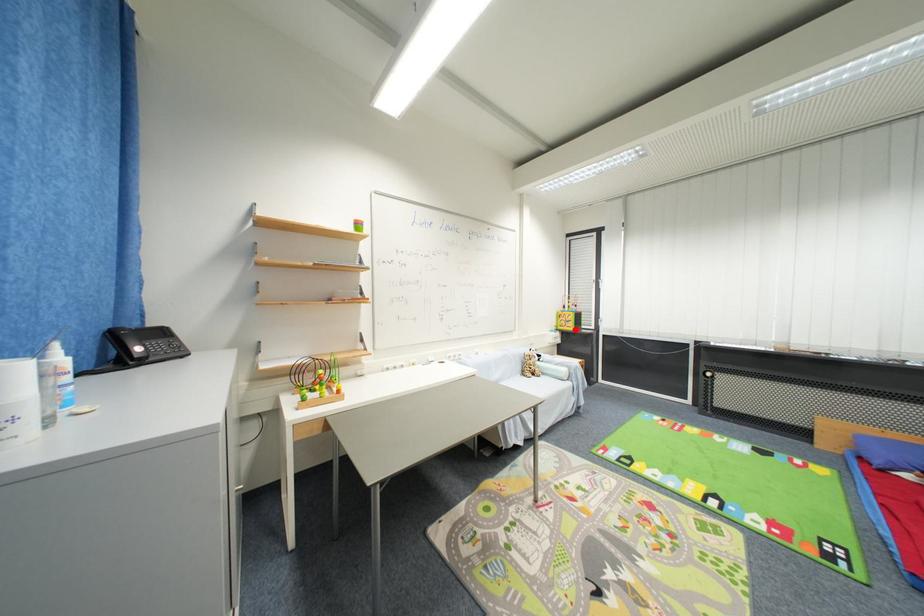
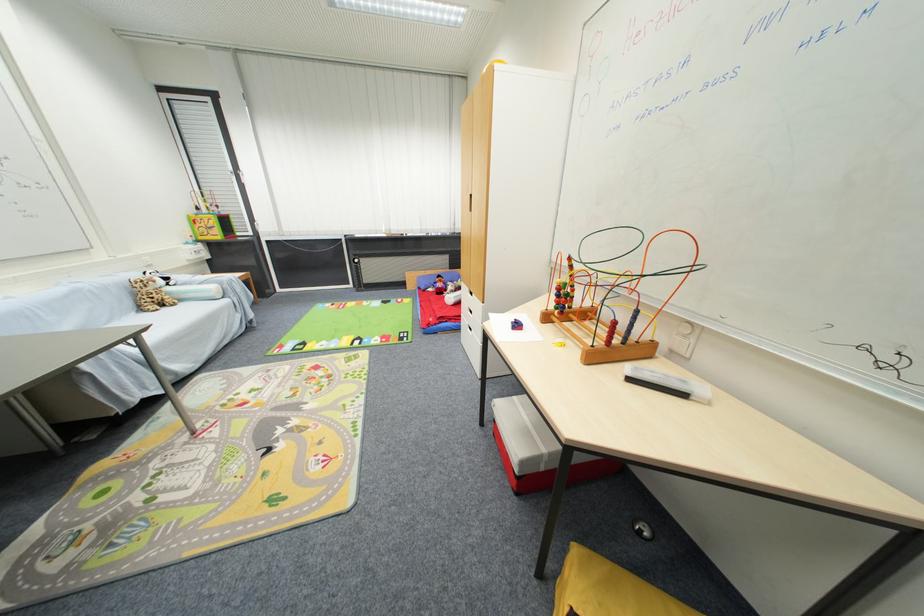
Locate, in the second image, the point that corresponds to the highlighted location in the first image.

(223, 238)